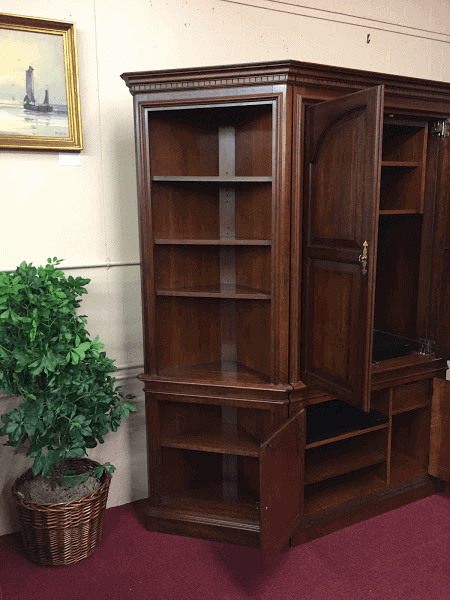
This screenshot has height=600, width=450. Identify the location of golden frame. (66, 34).